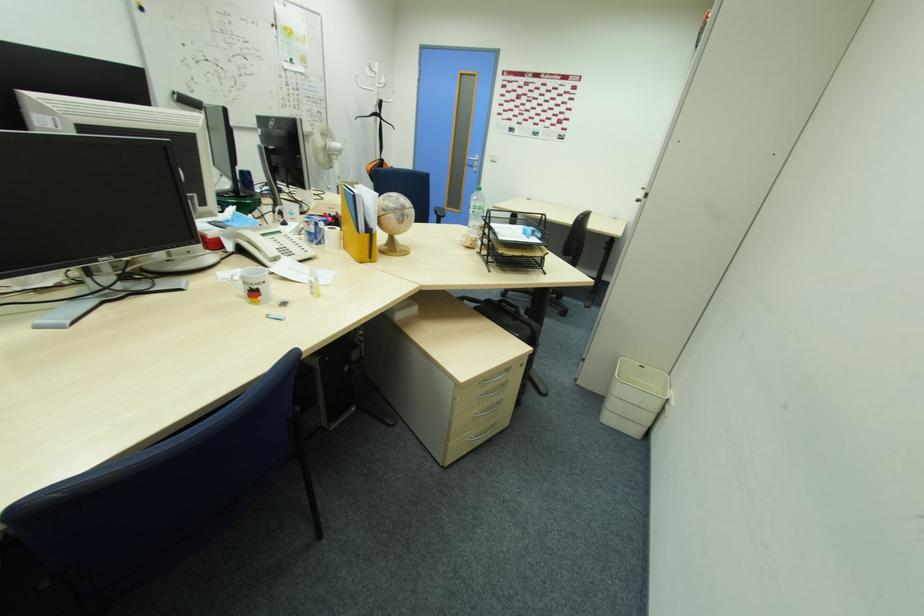
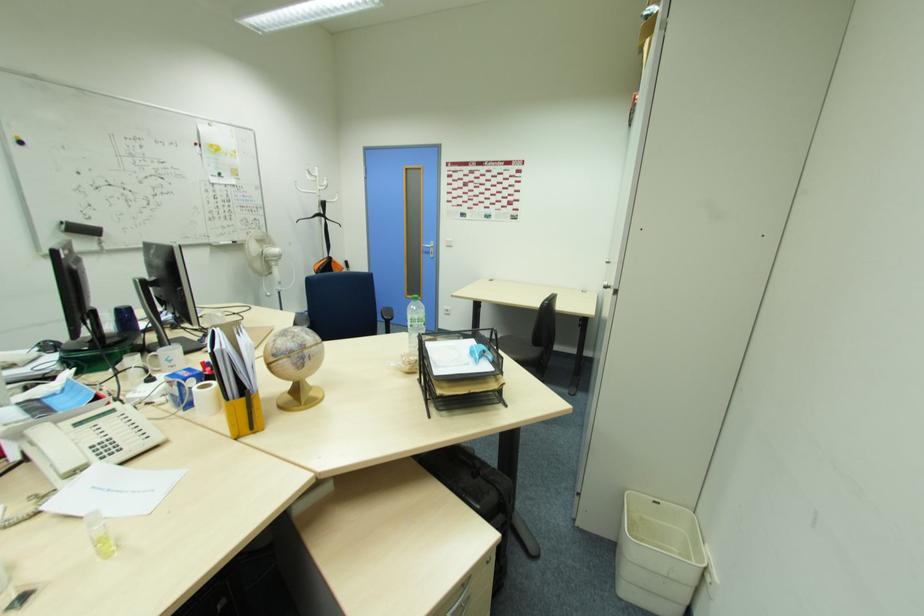
Where in the second image is the point corresponding to the point at 585,216 from the first image?

(549, 302)